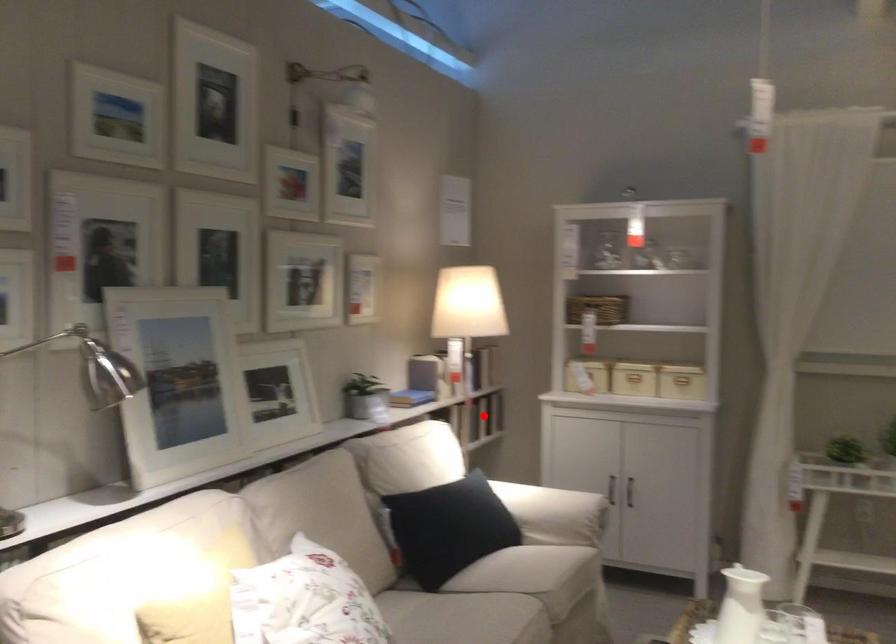
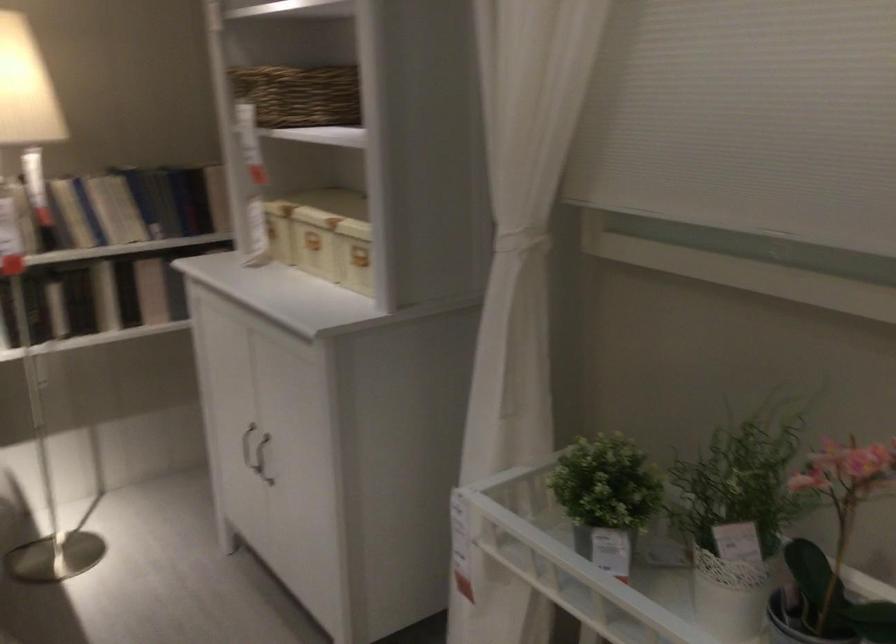
Question: I am providing you with two images of the same scene from different viewpoints. In image1, a red point is highlighted. Considering the same 3D point in image2, which of the following is correct?

Choices:
 (A) It is closer
 (B) It is farther

Answer: (A)